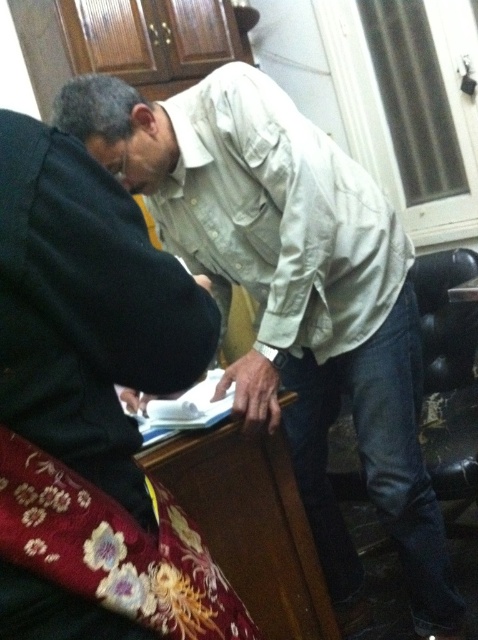
Question: Which object appears closest to the camera in this image?

Choices:
 (A) black matte laptop at left
 (B) light beige cotton shirt at center

Answer: (A)

Question: Does black matte laptop at left have a larger size compared to light beige cotton shirt at center?

Choices:
 (A) yes
 (B) no

Answer: (B)

Question: Observing the image, what is the correct spatial positioning of black matte laptop at left in reference to light beige cotton shirt at center?

Choices:
 (A) left
 (B) right

Answer: (A)

Question: Is black matte laptop at left further to the viewer compared to light beige cotton shirt at center?

Choices:
 (A) yes
 (B) no

Answer: (B)

Question: Which of the following is the closest to the observer?

Choices:
 (A) (203, 600)
 (B) (215, 240)

Answer: (A)